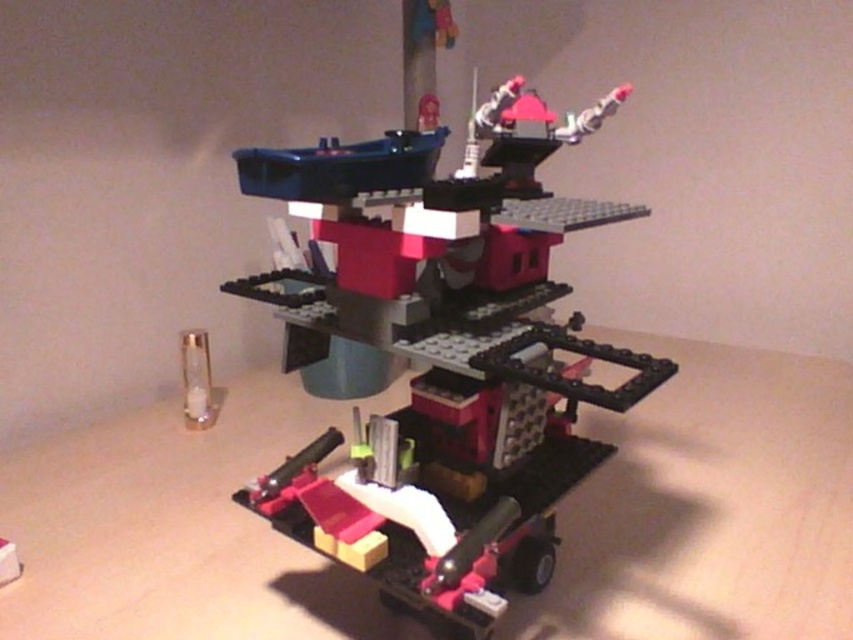
Question: In this image, where is black plastic table at center located relative to brick-like plastic tower at center?

Choices:
 (A) below
 (B) above

Answer: (A)

Question: Does black plastic table at center appear on the right side of brick-like plastic tower at center?

Choices:
 (A) no
 (B) yes

Answer: (B)

Question: Is black plastic table at center to the left of brick-like plastic tower at center from the viewer's perspective?

Choices:
 (A) yes
 (B) no

Answer: (B)

Question: Among these objects, which one is farthest from the camera?

Choices:
 (A) black plastic table at center
 (B) brick-like plastic tower at center

Answer: (A)